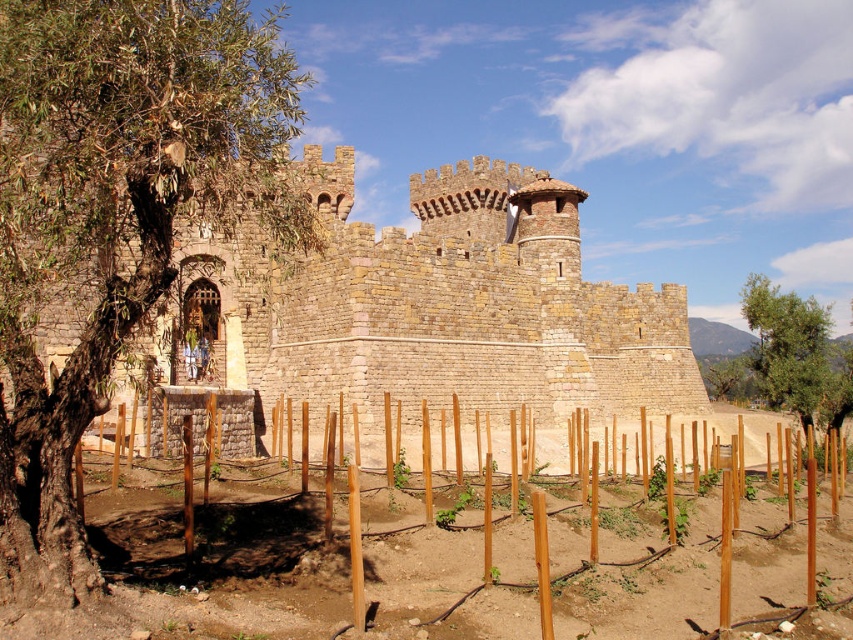
From the picture: Which of these two, brown wooden stakes at lower center or green leafy tree at right, stands taller?

Standing taller between the two is green leafy tree at right.

Is the position of brown wooden stakes at lower center more distant than that of green leafy tree at right?

No.

Where is `brown wooden stakes at lower center`? The height and width of the screenshot is (640, 853). brown wooden stakes at lower center is located at coordinates (265, 560).

At what (x,y) coordinates should I click in order to perform the action: click on brown wooden stakes at lower center. Please return your answer as a coordinate pair (x, y). The width and height of the screenshot is (853, 640). Looking at the image, I should click on (265, 560).

Can you confirm if rustic stone castle at center is smaller than brown wooden stakes at lower center?

No, rustic stone castle at center is not smaller than brown wooden stakes at lower center.

Can you confirm if rustic stone castle at center is positioned to the left of brown wooden stakes at lower center?

Indeed, rustic stone castle at center is positioned on the left side of brown wooden stakes at lower center.

What are the coordinates of `rustic stone castle at center` in the screenshot? It's located at (434, 307).

Can you confirm if green leafy tree at left is taller than brown wooden stakes at lower center?

Yes.

Does green leafy tree at left have a lesser width compared to brown wooden stakes at lower center?

Indeed, green leafy tree at left has a lesser width compared to brown wooden stakes at lower center.

The height and width of the screenshot is (640, 853). Find the location of `green leafy tree at left`. green leafy tree at left is located at coordinates (115, 216).